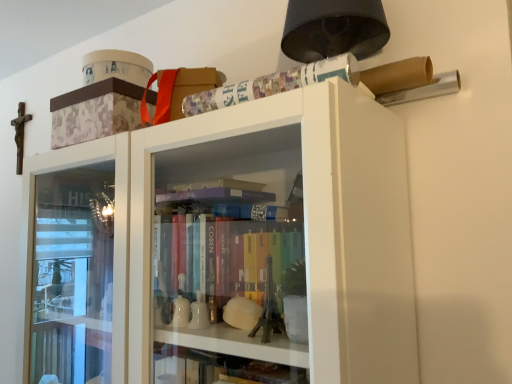
Question: Is multicolored paper at upper right wider than matte floral-patterned box at upper center?

Choices:
 (A) no
 (B) yes

Answer: (A)

Question: Can you confirm if multicolored paper at upper right is shorter than matte floral-patterned box at upper center?

Choices:
 (A) yes
 (B) no

Answer: (A)

Question: Can you confirm if multicolored paper at upper right is taller than matte floral-patterned box at upper center?

Choices:
 (A) yes
 (B) no

Answer: (B)

Question: Is multicolored paper at upper right to the left of matte floral-patterned box at upper center from the viewer's perspective?

Choices:
 (A) yes
 (B) no

Answer: (B)

Question: Would you consider multicolored paper at upper right to be distant from matte floral-patterned box at upper center?

Choices:
 (A) yes
 (B) no

Answer: (B)

Question: Is matte floral-patterned box at upper center inside multicolored paper at upper right?

Choices:
 (A) yes
 (B) no

Answer: (B)

Question: Is matte floral-patterned box at upper center to the right of multicolored paper at upper right from the viewer's perspective?

Choices:
 (A) yes
 (B) no

Answer: (B)

Question: Does matte floral-patterned box at upper center have a greater width compared to multicolored paper at upper right?

Choices:
 (A) yes
 (B) no

Answer: (A)

Question: Could you tell me if matte floral-patterned box at upper center is facing multicolored paper at upper right?

Choices:
 (A) no
 (B) yes

Answer: (A)

Question: Is multicolored paper at upper right completely or partially inside matte floral-patterned box at upper center?

Choices:
 (A) no
 (B) yes

Answer: (A)

Question: Is matte floral-patterned box at upper center positioned beyond the bounds of multicolored paper at upper right?

Choices:
 (A) yes
 (B) no

Answer: (A)

Question: From a real-world perspective, is matte floral-patterned box at upper center located beneath multicolored paper at upper right?

Choices:
 (A) no
 (B) yes

Answer: (A)

Question: Which is correct: multicolored paper at upper right is inside matte floral-patterned box at upper center, or outside of it?

Choices:
 (A) outside
 (B) inside

Answer: (A)